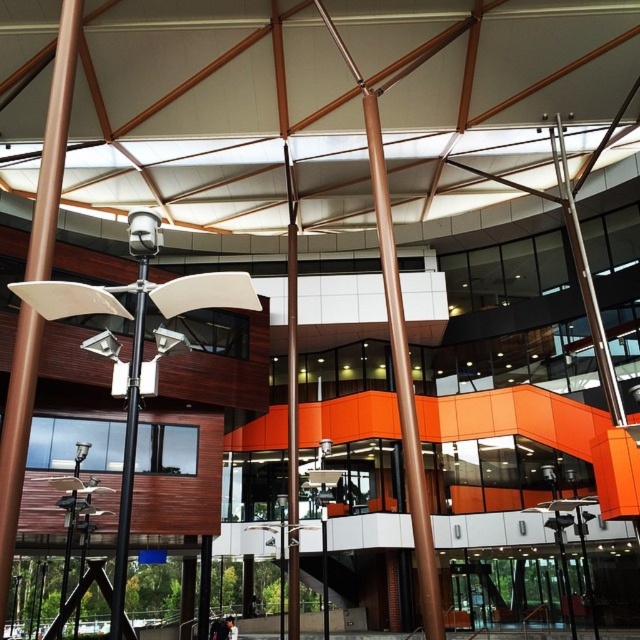
Question: Which point appears farthest from the camera in this image?

Choices:
 (A) (285, 268)
 (B) (609, 401)
 (C) (420, 580)
 (D) (113, 625)

Answer: (A)

Question: Does brown polished metal pole at center have a larger size compared to black metal pole at center?

Choices:
 (A) no
 (B) yes

Answer: (B)

Question: Which object is farther from the camera taking this photo?

Choices:
 (A) black metal pole at center
 (B) brown polished metal pole at center
 (C) brown polished pole at center
 (D) polished silver pole at upper right

Answer: (D)

Question: Which of the following is the closest to the observer?

Choices:
 (A) (388, 196)
 (B) (58, 132)
 (C) (595, 332)

Answer: (B)

Question: In this image, where is brown polished metal pole at center located relative to polished silver pole at upper right?

Choices:
 (A) left
 (B) right

Answer: (A)

Question: Does metallic pole at center have a larger size compared to black metal pole at center?

Choices:
 (A) yes
 (B) no

Answer: (A)